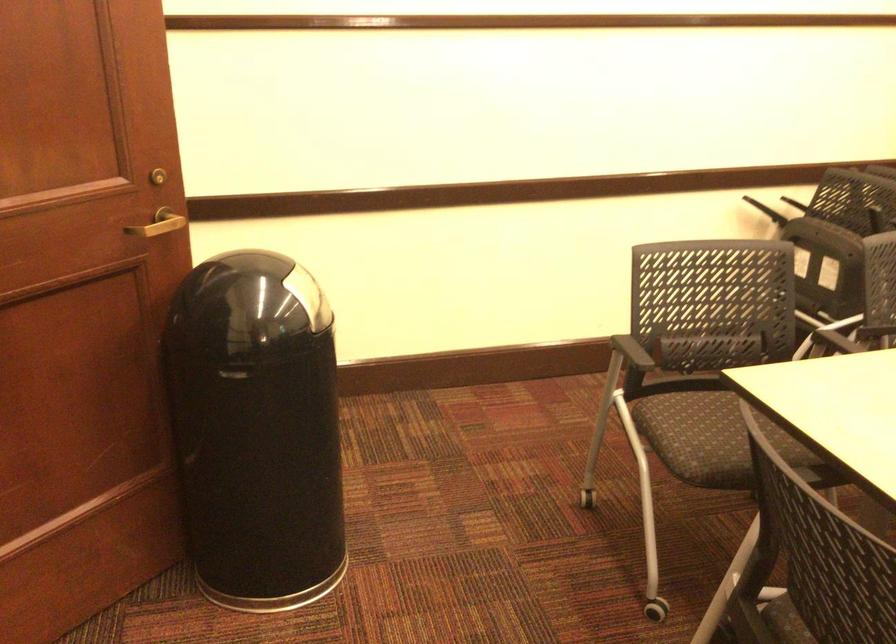
Identify the location of trash can flap. (308, 297).